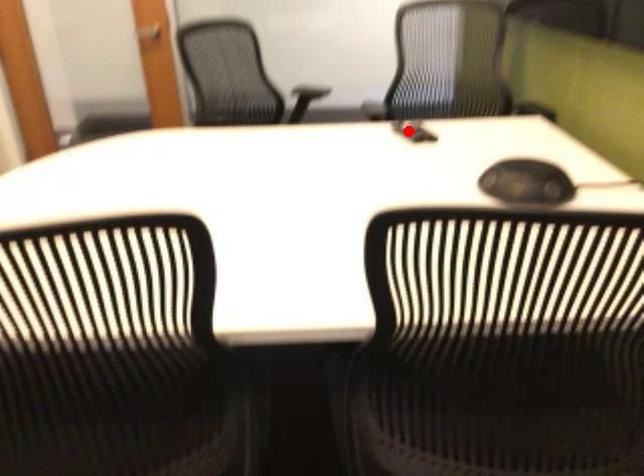
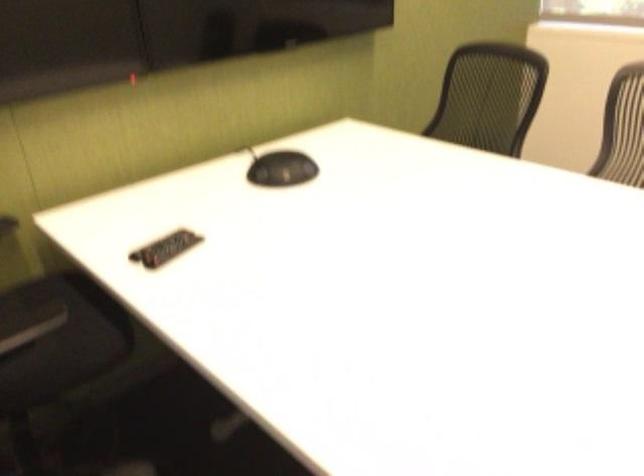
Question: I am providing you with two images of the same scene from different viewpoints. Given a red point in image1, look at the same physical point in image2. Is it:

Choices:
 (A) Closer to the viewpoint
 (B) Farther from the viewpoint

Answer: (A)